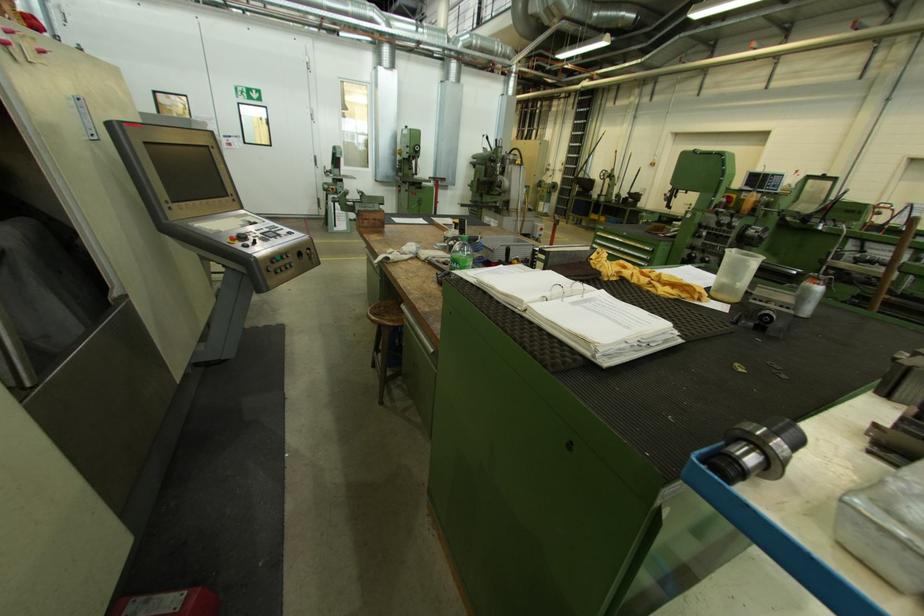
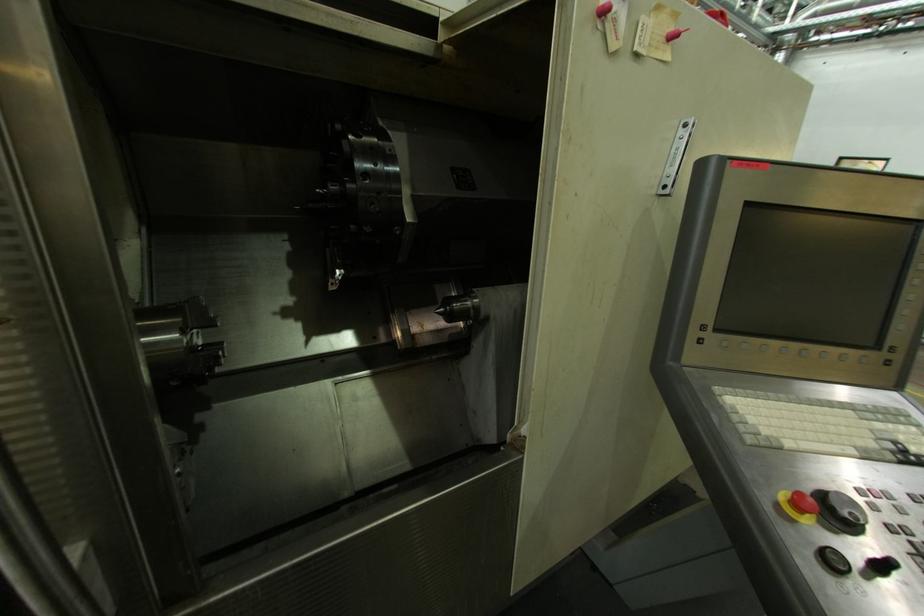
Where in the second image is the point corresponding to (x=261, y=244) from the first image?

(888, 569)